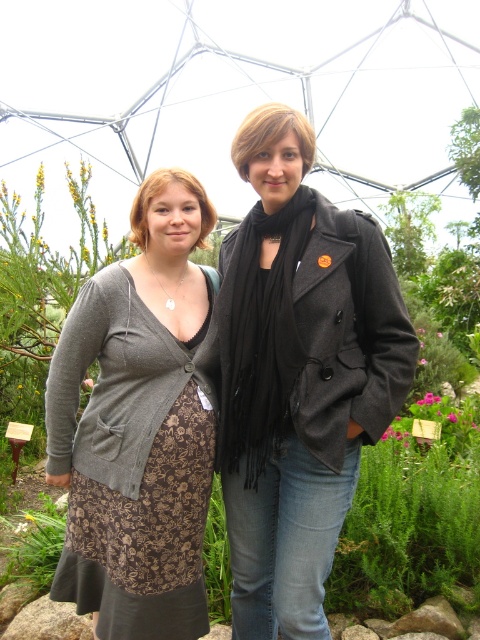
Is matte gray cardigan at center further to the viewer compared to matte brown dress at center?

No, matte gray cardigan at center is in front of matte brown dress at center.

Who is taller, matte gray cardigan at center or matte brown dress at center?

matte gray cardigan at center

Which is behind, point (202, 413) or point (200, 202)?

The point (200, 202) is behind.

At what (x,y) coordinates should I click in order to perform the action: click on matte gray cardigan at center. Please return your answer as a coordinate pair (x, y). The image size is (480, 640). Looking at the image, I should click on (139, 426).

Between green leafy plant at lower left and matte brown dress at center, which one is positioned lower?

green leafy plant at lower left

Can you confirm if green leafy plant at lower left is wider than matte brown dress at center?

Correct, the width of green leafy plant at lower left exceeds that of matte brown dress at center.

Image resolution: width=480 pixels, height=640 pixels. I want to click on green leafy plant at lower left, so click(x=35, y=544).

Where is `green leafy plant at lower left`? The height and width of the screenshot is (640, 480). green leafy plant at lower left is located at coordinates (35, 544).

From the picture: Does matte gray cardigan at center appear on the right side of matte black scarf at center?

No, matte gray cardigan at center is not to the right of matte black scarf at center.

From the picture: Can you confirm if matte gray cardigan at center is taller than matte black scarf at center?

Indeed, matte gray cardigan at center has a greater height compared to matte black scarf at center.

At what (x,y) coordinates should I click in order to perform the action: click on matte gray cardigan at center. Please return your answer as a coordinate pair (x, y). Looking at the image, I should click on (139, 426).